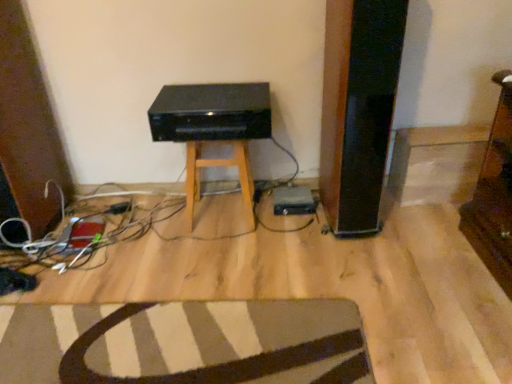
Image resolution: width=512 pixels, height=384 pixels. I want to click on black plastic plug at lower left, so click(x=119, y=208).

This screenshot has width=512, height=384. What do you see at coordinates (206, 366) in the screenshot?
I see `striped fabric rug at lower center` at bounding box center [206, 366].

Describe the element at coordinates (217, 166) in the screenshot. I see `black matte stool at center` at that location.

Where is `black plastic plug at lower left`? black plastic plug at lower left is located at coordinates (119, 208).

Based on the photo, which of these two, black matte stool at center or black plastic plug at lower left, is wider?

Wider between the two is black matte stool at center.

From the image's perspective, which is above, black matte stool at center or black plastic plug at lower left?

black matte stool at center appears higher in the image.

From a real-world perspective, is black matte stool at center positioned above or below black plastic plug at lower left?

In terms of real-world spatial position, black matte stool at center is above black plastic plug at lower left.

This screenshot has height=384, width=512. Find the location of `plug lying behind the black matte stool at center`. plug lying behind the black matte stool at center is located at coordinates (119, 208).

Considering the relative sizes of black plastic stereo at center and black plastic plug at lower left in the image provided, is black plastic stereo at center shorter than black plastic plug at lower left?

No, black plastic stereo at center is not shorter than black plastic plug at lower left.

Considering the relative positions of black plastic stereo at center and black plastic plug at lower left in the image provided, is black plastic stereo at center to the left of black plastic plug at lower left from the viewer's perspective?

No, black plastic stereo at center is not to the left of black plastic plug at lower left.

Looking at their sizes, would you say black plastic stereo at center is wider or thinner than black plastic plug at lower left?

In the image, black plastic stereo at center appears to be wider than black plastic plug at lower left.

Find the location of a particular element. stereo above the black plastic plug at lower left (from a real-world perspective) is located at coordinates (211, 112).

Is the position of black plastic plug at lower left more distant than that of black matte stool at center?

Yes, black plastic plug at lower left is further from the viewer.

Who is shorter, black plastic plug at lower left or black matte stool at center?

black plastic plug at lower left is shorter.

Looking at their sizes, would you say black plastic plug at lower left is wider or thinner than black matte stool at center?

Clearly, black plastic plug at lower left has less width compared to black matte stool at center.

Is the depth of black plastic plug at lower left less than that of striped fabric rug at lower center?

No, it is not.

From a real-world perspective, is black plastic plug at lower left under striped fabric rug at lower center?

No, from a real-world perspective, black plastic plug at lower left is not beneath striped fabric rug at lower center.

Can you tell me how much black plastic plug at lower left and striped fabric rug at lower center differ in facing direction?

The angle between the facing direction of black plastic plug at lower left and the facing direction of striped fabric rug at lower center is 121 degrees.

Can you confirm if black plastic stereo at center is smaller than black matte stool at center?

Yes, black plastic stereo at center is smaller than black matte stool at center.

Looking at this image, based on their positions, is black plastic stereo at center located to the left or right of black matte stool at center?

Clearly, black plastic stereo at center is on the left of black matte stool at center in the image.

Identify the location of stereo located above the black matte stool at center (from a real-world perspective). (211, 112).

In the image, is black plastic stereo at center positioned in front of or behind black matte stool at center?

black plastic stereo at center is in front of black matte stool at center.

Does point (259, 377) lie in front of point (251, 218)?

Yes.

Is striped fabric rug at lower center oriented towards black matte stool at center?

No, striped fabric rug at lower center is not facing towards black matte stool at center.

Considering the relative sizes of striped fabric rug at lower center and black matte stool at center in the image provided, is striped fabric rug at lower center wider than black matte stool at center?

Yes.

Is striped fabric rug at lower center closer to camera compared to black matte stool at center?

Yes, striped fabric rug at lower center is closer to the camera.

Where is `furniture below the black plastic plug at lower left (from a real-world perspective)`? The width and height of the screenshot is (512, 384). furniture below the black plastic plug at lower left (from a real-world perspective) is located at coordinates (206, 366).

Does striped fabric rug at lower center have a greater width compared to black plastic plug at lower left?

Yes.

Is striped fabric rug at lower center in contact with black plastic plug at lower left?

They are not placed beside each other.

In the image, is striped fabric rug at lower center positioned in front of or behind black plastic plug at lower left?

striped fabric rug at lower center is in front of black plastic plug at lower left.

Locate an element on the screen. The image size is (512, 384). stool lying above the black plastic plug at lower left (from the image's perspective) is located at coordinates (217, 166).

Locate an element on the screen. stereo in front of the black plastic plug at lower left is located at coordinates (211, 112).

When comparing their distances from black matte stool at center, does black plastic stereo at center or black plastic plug at lower left seem closer?

black plastic stereo at center.

When comparing their distances from black matte stool at center, does black plastic plug at lower left or black plastic stereo at center seem closer?

black plastic stereo at center is closer to black matte stool at center.

Looking at the image, which one is located further to black plastic plug at lower left, black matte stool at center or striped fabric rug at lower center?

The object further to black plastic plug at lower left is striped fabric rug at lower center.

From the image, which object appears to be nearer to black matte stool at center, black plastic stereo at center or striped fabric rug at lower center?

black plastic stereo at center is positioned closer to the anchor black matte stool at center.

Based on their spatial positions, is black plastic stereo at center or striped fabric rug at lower center further from black plastic plug at lower left?

The object further to black plastic plug at lower left is striped fabric rug at lower center.

Estimate the real-world distances between objects in this image. Which object is closer to black plastic stereo at center, black plastic plug at lower left or striped fabric rug at lower center?

black plastic plug at lower left is positioned closer to the anchor black plastic stereo at center.

Looking at the image, which one is located further to black plastic stereo at center, striped fabric rug at lower center or black matte stool at center?

striped fabric rug at lower center lies further to black plastic stereo at center than the other object.

Based on their spatial positions, is black plastic plug at lower left or striped fabric rug at lower center closer to black matte stool at center?

The object closer to black matte stool at center is black plastic plug at lower left.

The image size is (512, 384). Identify the location of stool that lies between black plastic stereo at center and striped fabric rug at lower center from top to bottom. (217, 166).

Find the location of a particular element. This screenshot has height=384, width=512. stool between striped fabric rug at lower center and black plastic plug at lower left along the z-axis is located at coordinates (217, 166).

Locate an element on the screen. Image resolution: width=512 pixels, height=384 pixels. stereo between black plastic plug at lower left and black matte stool at center from left to right is located at coordinates (211, 112).

Locate an element on the screen. The image size is (512, 384). plug between black plastic stereo at center and striped fabric rug at lower center vertically is located at coordinates (119, 208).